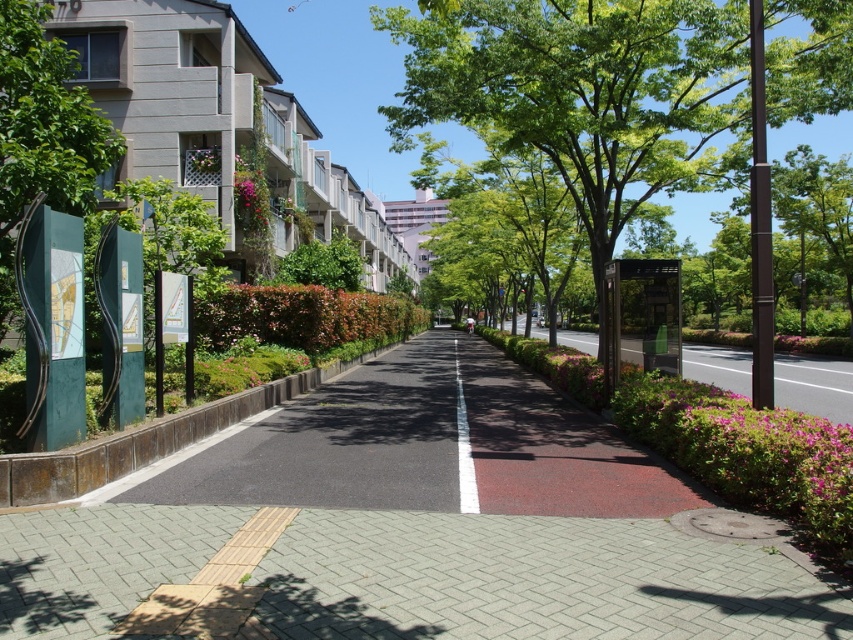
You are a photographer standing at the edge of the sidewalk. You want to take a photo of the green leafy tree at center. If your camera has a maximum focus distance of 8 meters, will you be able to capture the tree clearly?

The green leafy tree at center and camera are 7.89 meters apart, so yes, the camera can focus on the tree clearly since the distance is within the 8 meter limit.

You are a delivery person needing to cross the street from the sidewalk to the smooth asphalt road at center. The green leafy tree at left is blocking your path. Can you go around it by moving to the right side of the tree?

The smooth asphalt road at center is positioned on the right side of green leafy tree at left, so yes, you can go around the green leafy tree at left by moving to the right side of it to reach the smooth asphalt road at center.

You are standing at the entrance of the sidewalk and want to walk towards the green leafy tree at center. Which direction should you head?

The green leafy tree at center is located at point (614, 86), so you should head towards the center of the image to reach it.